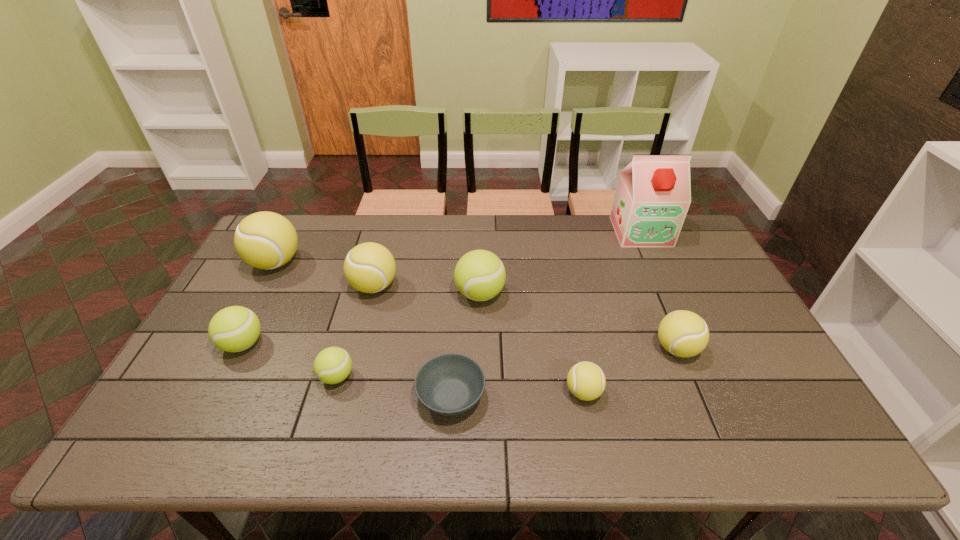
The height and width of the screenshot is (540, 960). Identify the location of the nearest yellow tennis ball. (586, 381).

Locate an element on the screen. The image size is (960, 540). the second yellow tennis ball from right to left is located at coordinates (586, 381).

In order to click on gray soup bowl in this screenshot , I will do `click(449, 384)`.

This screenshot has width=960, height=540. Identify the location of the shortest object. (449, 384).

Locate an element on the screen. The height and width of the screenshot is (540, 960). vacant area situated with the cap open on the tallest object is located at coordinates (678, 312).

Identify the location of free region located on the back of the biggest yellow tennis ball. This screenshot has height=540, width=960. (298, 222).

What are the coordinates of `vacant space situated 0.270m on the front of the third smallest yellow tennis ball` in the screenshot? It's located at (349, 381).

The width and height of the screenshot is (960, 540). Identify the location of vacant space situated 0.220m on the front of the farthest green tennis ball. (480, 376).

This screenshot has height=540, width=960. I want to click on vacant position located 0.390m on the back of the second smallest yellow tennis ball, so click(x=633, y=245).

Where is `vacant point located 0.120m on the right of the second smallest green tennis ball`? This screenshot has width=960, height=540. vacant point located 0.120m on the right of the second smallest green tennis ball is located at coordinates (310, 344).